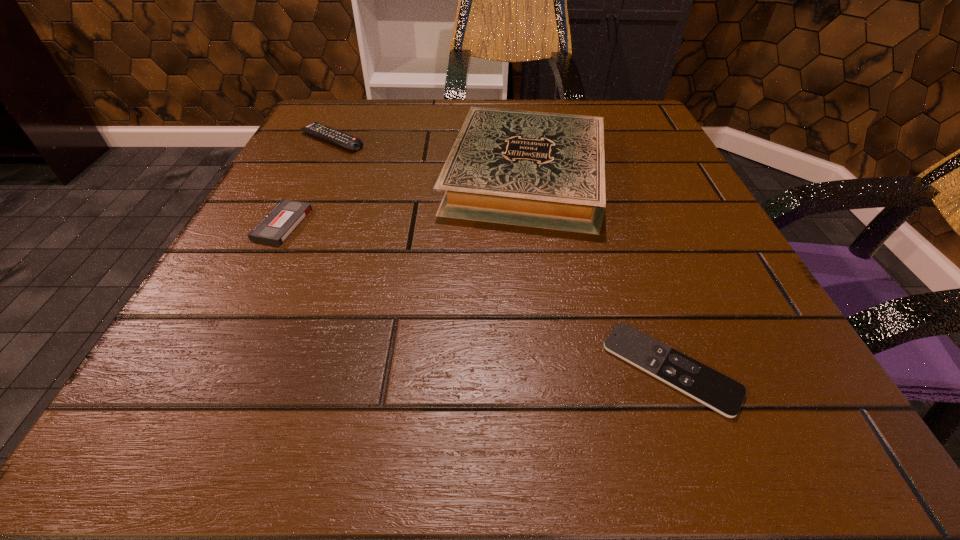
Where is `free space that satisfies the following two spatial constraints: 1. on the front side of the second shortest object; 2. on the right side of the right remote control`? The height and width of the screenshot is (540, 960). free space that satisfies the following two spatial constraints: 1. on the front side of the second shortest object; 2. on the right side of the right remote control is located at coordinates (208, 369).

The height and width of the screenshot is (540, 960). I want to click on free spot that satisfies the following two spatial constraints: 1. on the front side of the shorter remote control; 2. on the right side of the tallest object, so click(x=552, y=369).